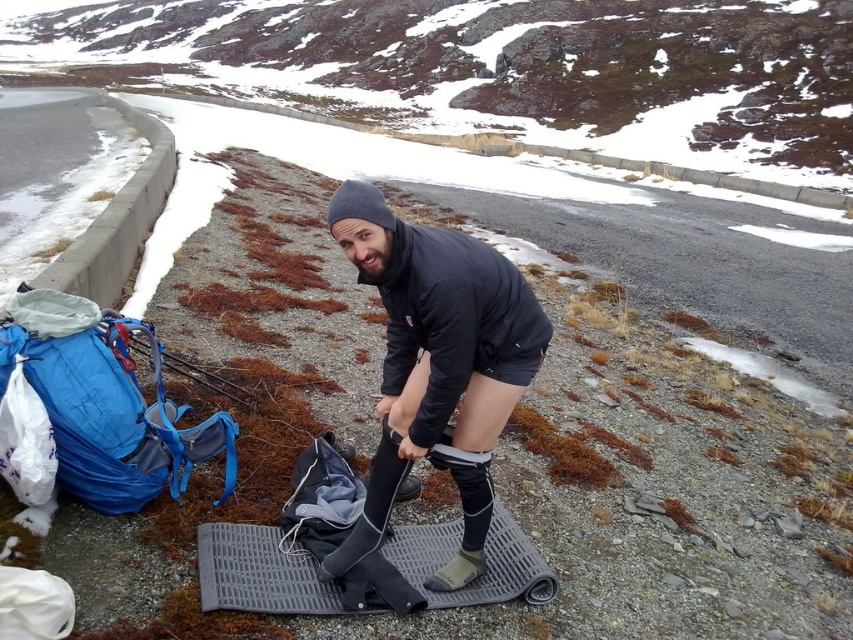
Question: Observing the image, what is the correct spatial positioning of black matte jacket at center in reference to gray rubber mat at center?

Choices:
 (A) right
 (B) left

Answer: (A)

Question: Can you confirm if black matte jacket at center is thinner than gray rubber mat at center?

Choices:
 (A) no
 (B) yes

Answer: (B)

Question: Which object is closer to the camera taking this photo?

Choices:
 (A) black matte jacket at center
 (B) gray rubber mat at center

Answer: (A)

Question: Among these objects, which one is nearest to the camera?

Choices:
 (A) gray rubber mat at center
 (B) black matte jacket at center

Answer: (B)

Question: Can you confirm if black matte jacket at center is wider than gray rubber mat at center?

Choices:
 (A) no
 (B) yes

Answer: (A)